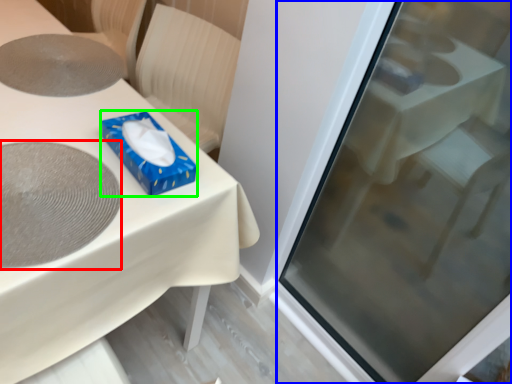
Question: Estimate the real-world distances between objects in this image. Which object is farther from oval (highlighted by a red box), screen door (highlighted by a blue box) or box (highlighted by a green box)?

Choices:
 (A) screen door
 (B) box

Answer: (A)